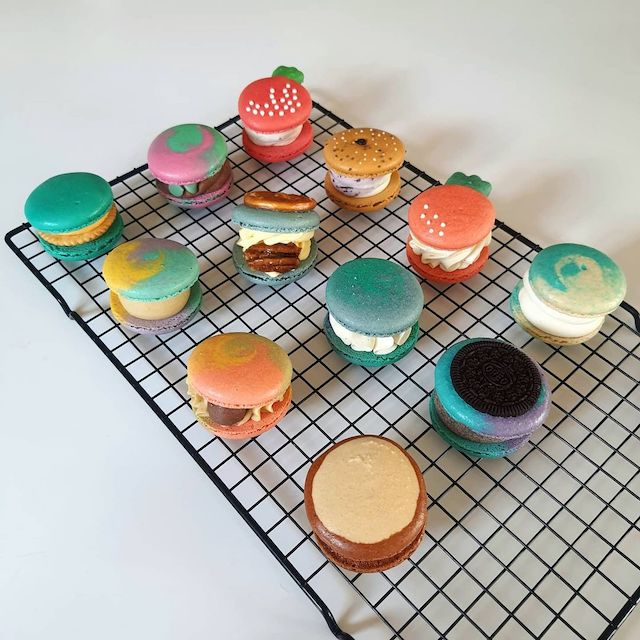
Find the location of a particular element. cooling rack is located at coordinates (557, 509).